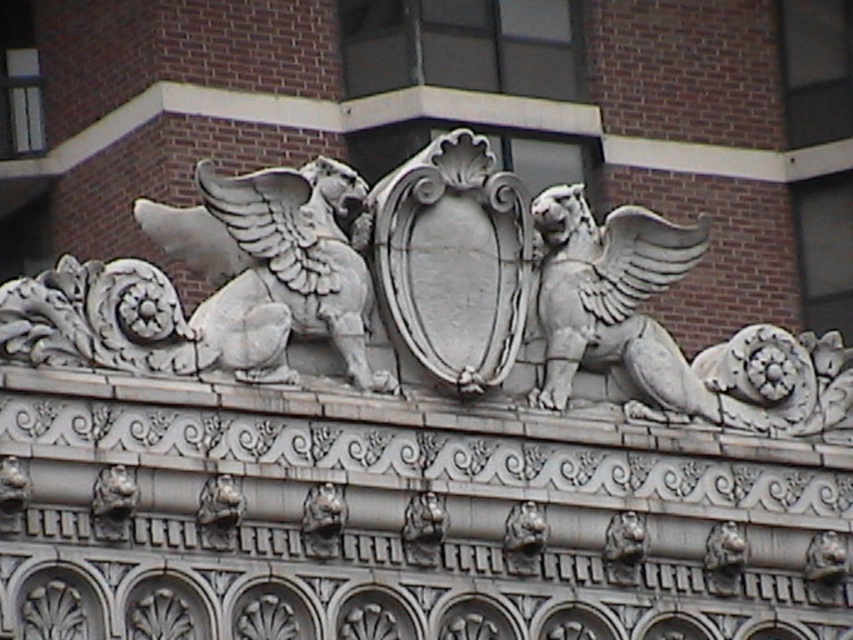
Question: Can you confirm if white stone gryphon at right is smaller than white stone winged lion at upper left?

Choices:
 (A) yes
 (B) no

Answer: (B)

Question: Which point is closer to the camera?

Choices:
 (A) pyautogui.click(x=210, y=173)
 (B) pyautogui.click(x=604, y=289)

Answer: (A)

Question: Does white stone gryphon at right appear on the right side of white stone winged lion at upper left?

Choices:
 (A) yes
 (B) no

Answer: (A)

Question: Does white stone gryphon at right have a lesser width compared to white stone winged lion at upper left?

Choices:
 (A) no
 (B) yes

Answer: (A)